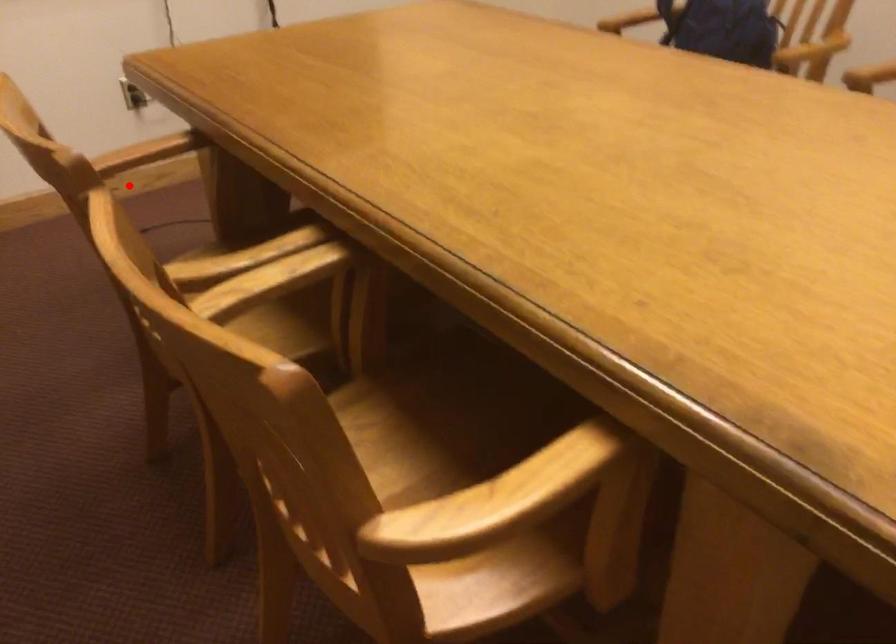
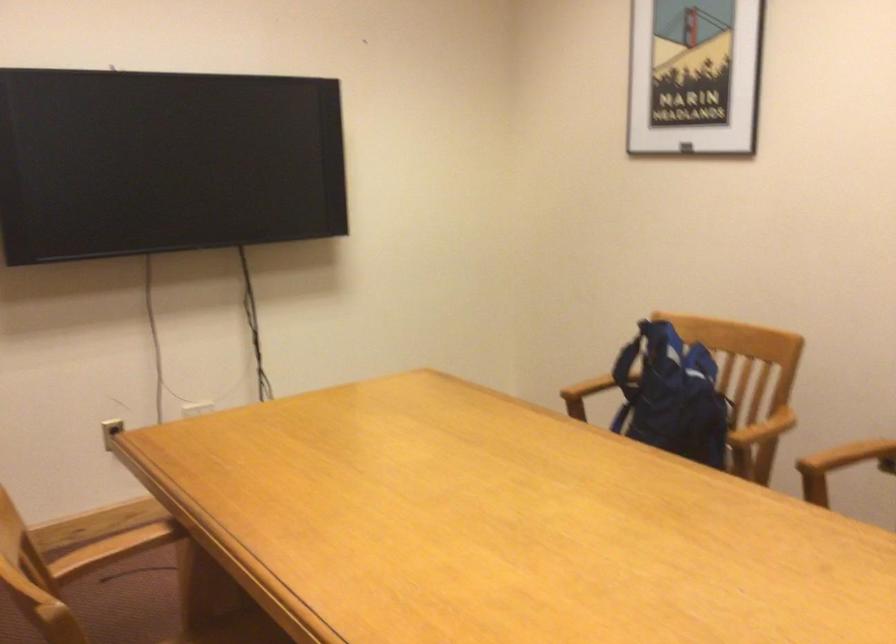
Find the pixel in the second image that matches the highlighted location in the first image.

(92, 526)